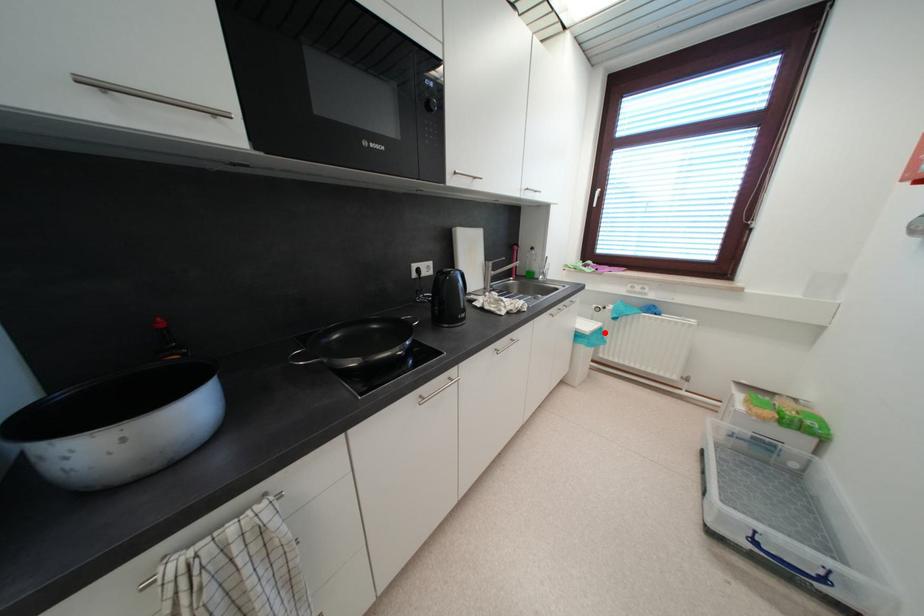
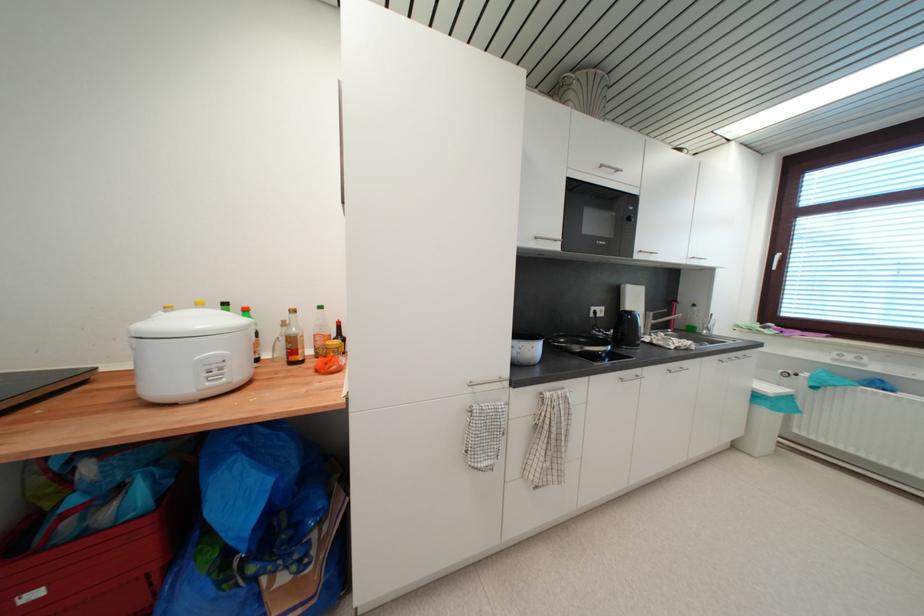
Question: I am providing you with two images of the same scene from different viewpoints. In image1, a red point is highlighted. Considering the same 3D point in image2, which of the following is correct?

Choices:
 (A) It is closer
 (B) It is farther

Answer: (A)